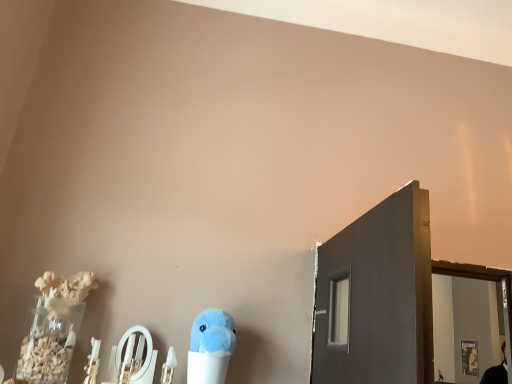
Question: Is fluffy blue plush at center inside the boundaries of metallic silver mirror at lower center, or outside?

Choices:
 (A) inside
 (B) outside

Answer: (B)

Question: Looking at the image, does fluffy blue plush at center seem bigger or smaller compared to metallic silver mirror at lower center?

Choices:
 (A) big
 (B) small

Answer: (A)

Question: From a real-world perspective, is fluffy blue plush at center physically located above or below metallic silver mirror at lower center?

Choices:
 (A) above
 (B) below

Answer: (A)

Question: Looking at the image, does metallic silver mirror at lower center seem bigger or smaller compared to fluffy blue plush at center?

Choices:
 (A) small
 (B) big

Answer: (A)

Question: Is metallic silver mirror at lower center inside or outside of fluffy blue plush at center?

Choices:
 (A) outside
 (B) inside

Answer: (A)

Question: Looking at their shapes, would you say metallic silver mirror at lower center is wider or thinner than fluffy blue plush at center?

Choices:
 (A) thin
 (B) wide

Answer: (A)

Question: From the image's perspective, is metallic silver mirror at lower center positioned above or below fluffy blue plush at center?

Choices:
 (A) below
 (B) above

Answer: (B)